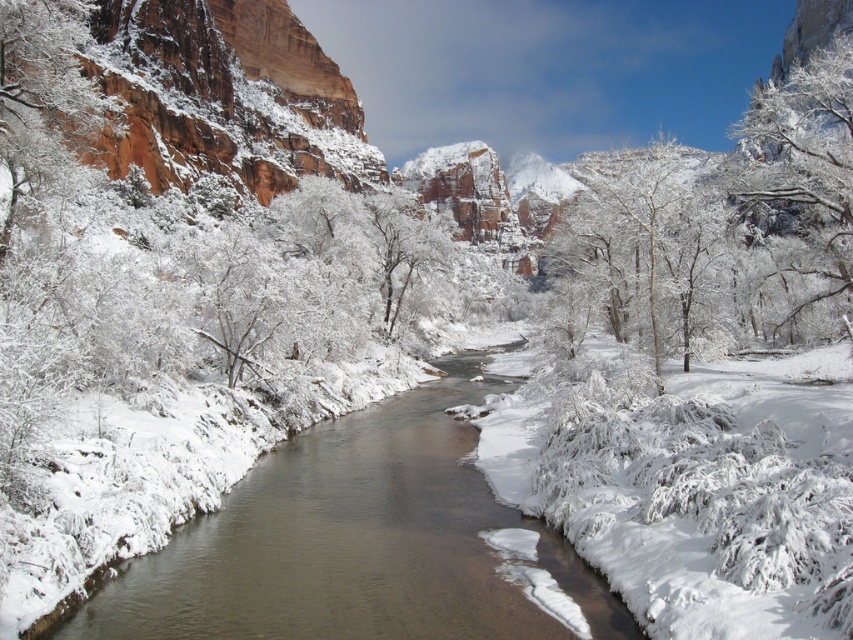
Question: Can you confirm if white frosty tree at center is smaller than white frosty branches at upper right?

Choices:
 (A) yes
 (B) no

Answer: (A)

Question: Which point is farther from the camera taking this photo?

Choices:
 (A) (849, 243)
 (B) (596, 276)

Answer: (B)

Question: Which of the following is the closest to the observer?

Choices:
 (A) white frosty branches at upper right
 (B) white frosty tree at center
 (C) brown smooth stream at center

Answer: (C)

Question: Does white frosty tree at center appear on the left side of white frosty branches at upper right?

Choices:
 (A) yes
 (B) no

Answer: (A)

Question: Which of the following is the closest to the observer?

Choices:
 (A) (669, 348)
 (B) (839, 104)

Answer: (A)

Question: Can you confirm if white frosty tree at center is positioned to the left of white frosty branches at upper right?

Choices:
 (A) yes
 (B) no

Answer: (A)